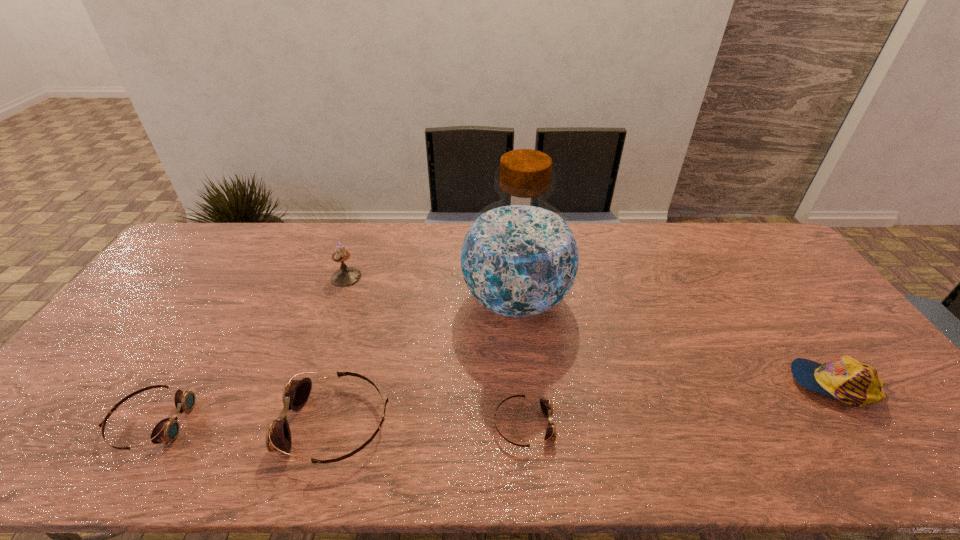
This screenshot has width=960, height=540. I want to click on free location that satisfies the following two spatial constraints: 1. on the front side of the tallest object; 2. through the lenses of the second shortest goggles, so click(x=527, y=422).